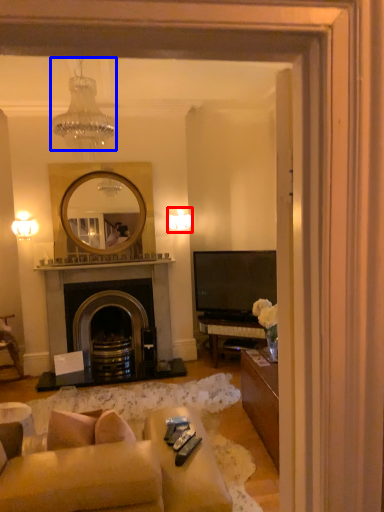
Question: Which of the following is the farthest to the observer, lamp (highlighted by a red box) or lamp (highlighted by a blue box)?

Choices:
 (A) lamp
 (B) lamp

Answer: (A)